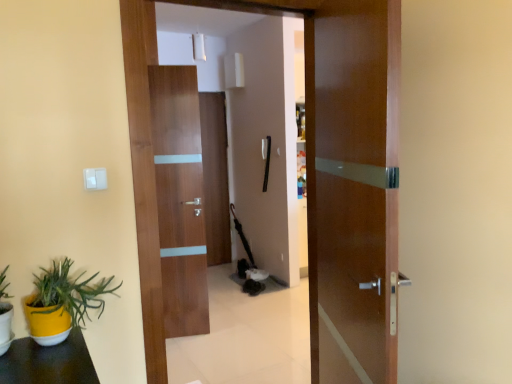
Question: Can you confirm if walnut wood door at center, which appears as the 2th door when viewed from the back, is shorter than yellow matte flowerpot at lower left?

Choices:
 (A) yes
 (B) no

Answer: (B)

Question: From a real-world perspective, is walnut wood door at center, acting as the third door starting from the front, below yellow matte flowerpot at lower left?

Choices:
 (A) no
 (B) yes

Answer: (A)

Question: Is walnut wood door at center, which appears as the 2th door when viewed from the back, next to yellow matte flowerpot at lower left?

Choices:
 (A) yes
 (B) no

Answer: (B)

Question: Is walnut wood door at center, which appears as the 2th door when viewed from the back, outside yellow matte flowerpot at lower left?

Choices:
 (A) no
 (B) yes

Answer: (B)

Question: Considering the relative sizes of walnut wood door at center, acting as the third door starting from the front, and yellow matte flowerpot at lower left in the image provided, is walnut wood door at center, acting as the third door starting from the front, taller than yellow matte flowerpot at lower left?

Choices:
 (A) yes
 (B) no

Answer: (A)

Question: Would you say glossy wood door at center, which ranks as the 4th door in back-to-front order, is inside or outside yellow matte flowerpot at lower left?

Choices:
 (A) outside
 (B) inside

Answer: (A)

Question: Based on their positions, is glossy wood door at center, which ranks as the 4th door in back-to-front order, located to the left or right of yellow matte flowerpot at lower left?

Choices:
 (A) left
 (B) right

Answer: (B)

Question: Considering the positions of glossy wood door at center, arranged as the first door when viewed from the front, and yellow matte flowerpot at lower left in the image, is glossy wood door at center, arranged as the first door when viewed from the front, bigger or smaller than yellow matte flowerpot at lower left?

Choices:
 (A) small
 (B) big

Answer: (B)

Question: Looking at their shapes, would you say glossy wood door at center, arranged as the first door when viewed from the front, is wider or thinner than yellow matte flowerpot at lower left?

Choices:
 (A) wide
 (B) thin

Answer: (A)

Question: Is wooden door at center, which is counted as the third door, starting from the back, taller or shorter than matte wood door at center, which ranks as the first door in back-to-front order?

Choices:
 (A) short
 (B) tall

Answer: (A)

Question: Is point (384, 349) positioned closer to the camera than point (203, 210)?

Choices:
 (A) farther
 (B) closer

Answer: (B)

Question: From a real-world perspective, relative to matte wood door at center, positioned as the 4th door in front-to-back order, is wooden door at center, the 2th door in the front-to-back sequence, vertically above or below?

Choices:
 (A) below
 (B) above

Answer: (B)

Question: Is wooden door at center, the 2th door in the front-to-back sequence, in front of or behind matte wood door at center, which ranks as the first door in back-to-front order, in the image?

Choices:
 (A) behind
 (B) front

Answer: (B)

Question: Looking at their shapes, would you say yellow matte flowerpot at lower left is wider or thinner than walnut wood door at center, acting as the third door starting from the front?

Choices:
 (A) wide
 (B) thin

Answer: (A)

Question: Would you say yellow matte flowerpot at lower left is inside or outside walnut wood door at center, acting as the third door starting from the front?

Choices:
 (A) outside
 (B) inside

Answer: (A)